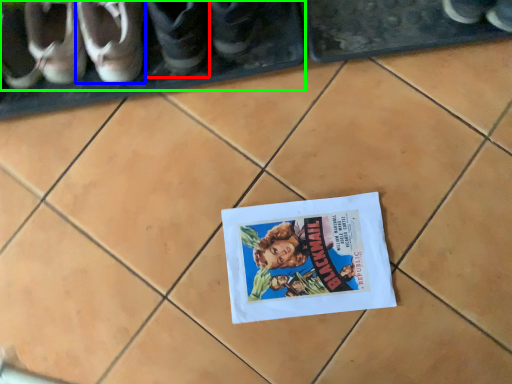
Question: Which object is the closest to the footwear (highlighted by a red box)? Choose among these: footwear (highlighted by a blue box) or footwear (highlighted by a green box).

Choices:
 (A) footwear
 (B) footwear

Answer: (A)